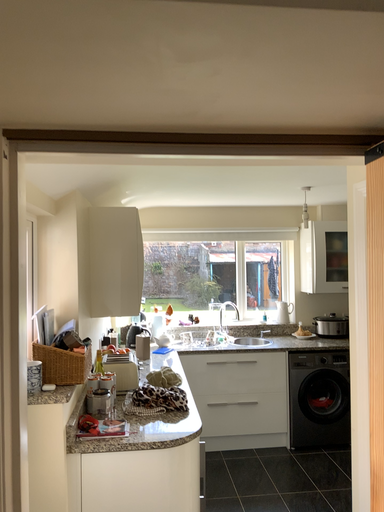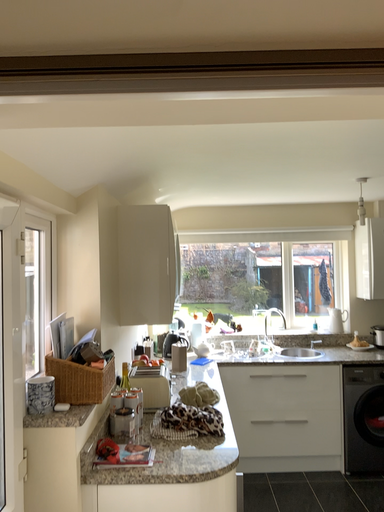
Question: Which way did the camera rotate in the video?

Choices:
 (A) rotated left
 (B) rotated right

Answer: (A)